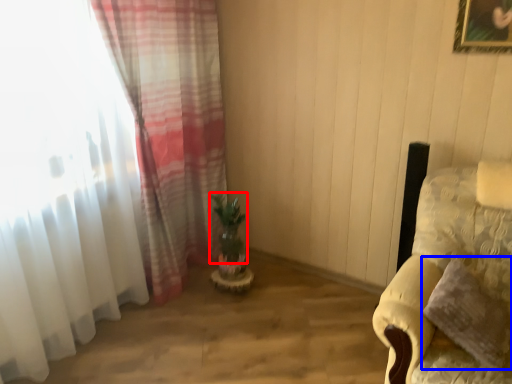
Question: Which object is further to the camera taking this photo, plant (highlighted by a red box) or pillow (highlighted by a blue box)?

Choices:
 (A) plant
 (B) pillow

Answer: (A)